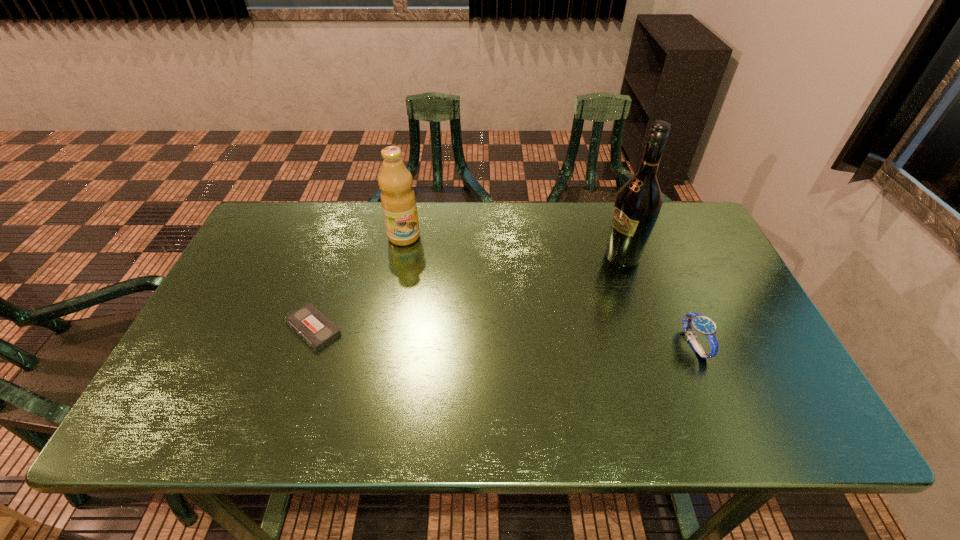
This screenshot has width=960, height=540. Identify the location of vacant area that lies between the third object from left to right and the watch. (659, 300).

Locate an element on the screen. free space that is in between the second shortest object and the second object from right to left is located at coordinates (659, 300).

Where is `free space that is in between the tallest object and the shortest object`? Image resolution: width=960 pixels, height=540 pixels. free space that is in between the tallest object and the shortest object is located at coordinates 468,293.

Identify the location of free spot between the wine bottle and the third shortest object. The image size is (960, 540). (514, 247).

What are the coordinates of `blank region between the third tallest object and the second object from right to left` in the screenshot? It's located at (659, 300).

The image size is (960, 540). Find the location of `free area in between the videotape and the rightmost object`. free area in between the videotape and the rightmost object is located at coordinates (504, 336).

Select which object appears as the closest to the third object from left to right. Please provide its 2D coordinates. Your answer should be formatted as a tuple, i.e. [(x, y)], where the tuple contains the x and y coordinates of a point satisfying the conditions above.

[(704, 326)]

The height and width of the screenshot is (540, 960). I want to click on object that ranks as the second closest to the leftmost object, so click(x=638, y=202).

Where is `vacant position in the image that satisfies the following two spatial constraints: 1. on the front side of the videotape; 2. on the left side of the second shortest object`? This screenshot has height=540, width=960. vacant position in the image that satisfies the following two spatial constraints: 1. on the front side of the videotape; 2. on the left side of the second shortest object is located at coordinates (308, 345).